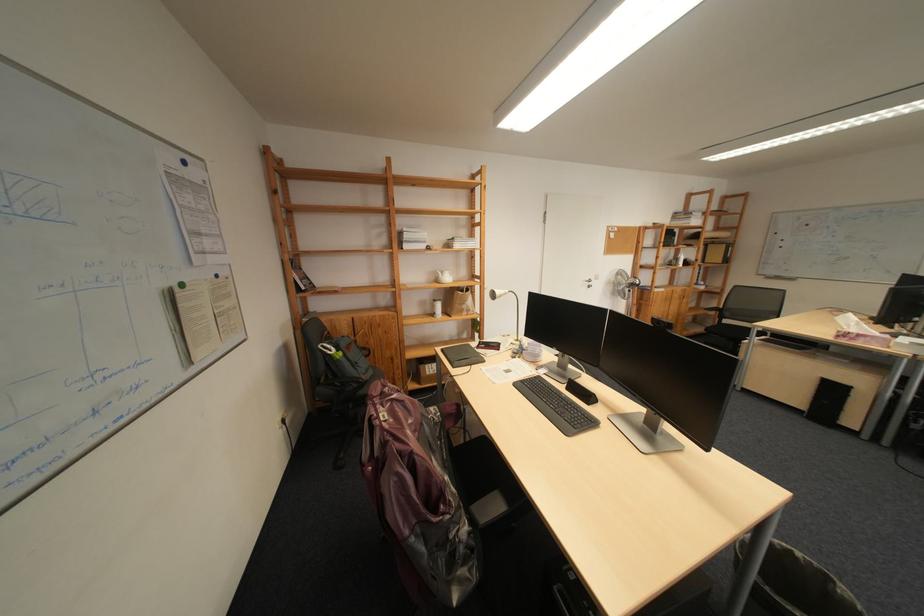
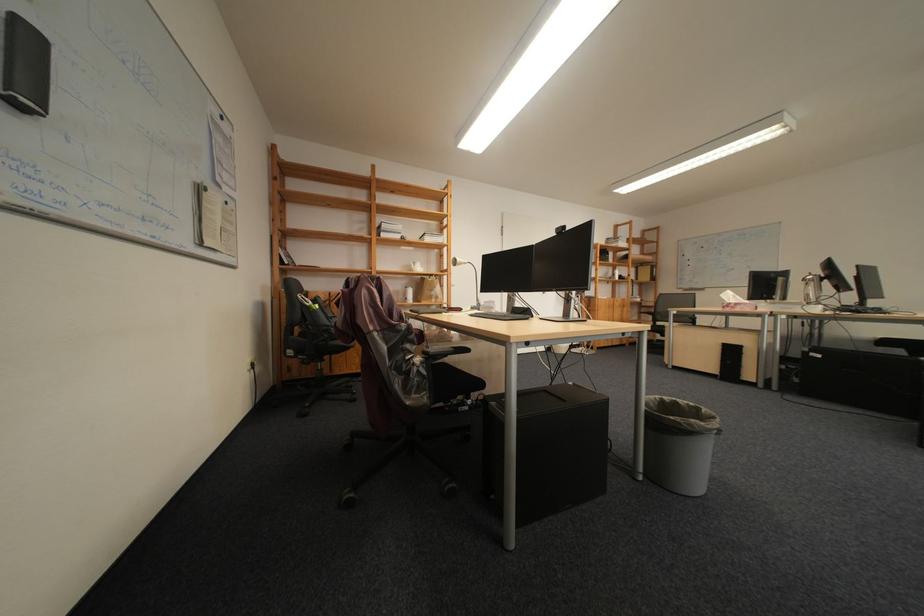
Question: The images are taken continuously from a first-person perspective. In which direction is your viewpoint rotating?

Choices:
 (A) Left
 (B) Right
 (C) Up
 (D) Down

Answer: (C)